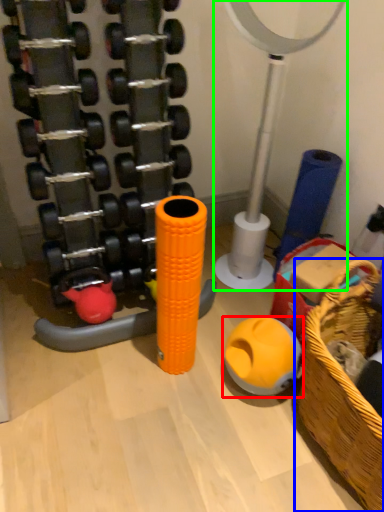
Question: Estimate the real-world distances between objects in this image. Which object is closer to toy (highlighted by a red box), basket (highlighted by a blue box) or basketball hoop (highlighted by a green box)?

Choices:
 (A) basket
 (B) basketball hoop

Answer: (A)